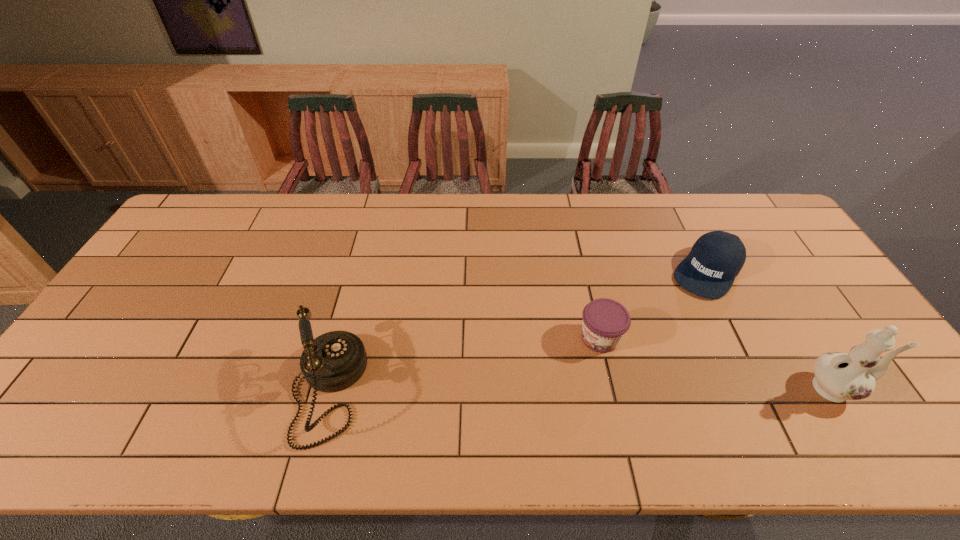
This screenshot has height=540, width=960. I want to click on telephone, so click(x=334, y=361).

Find the location of `the third shortest object`. the third shortest object is located at coordinates (334, 361).

Locate an element on the screen. the tallest object is located at coordinates (839, 377).

Where is `the farthest object`? The image size is (960, 540). the farthest object is located at coordinates (716, 258).

Where is `jam`? This screenshot has height=540, width=960. jam is located at coordinates (605, 321).

Find the location of a particular element. The image size is (960, 540). free space located 0.260m on the left of the second tallest object is located at coordinates (184, 390).

What are the coordinates of `vacant space positioned 0.300m on the front-facing side of the baseball cap` in the screenshot? It's located at pyautogui.click(x=645, y=359).

Where is `free space located on the front-facing side of the baseball cap`? The image size is (960, 540). free space located on the front-facing side of the baseball cap is located at coordinates (636, 372).

Identify the location of blank area located on the front-facing side of the baseball cap. (656, 344).

The image size is (960, 540). I want to click on free space located on the front label of the second object from left to right, so click(562, 365).